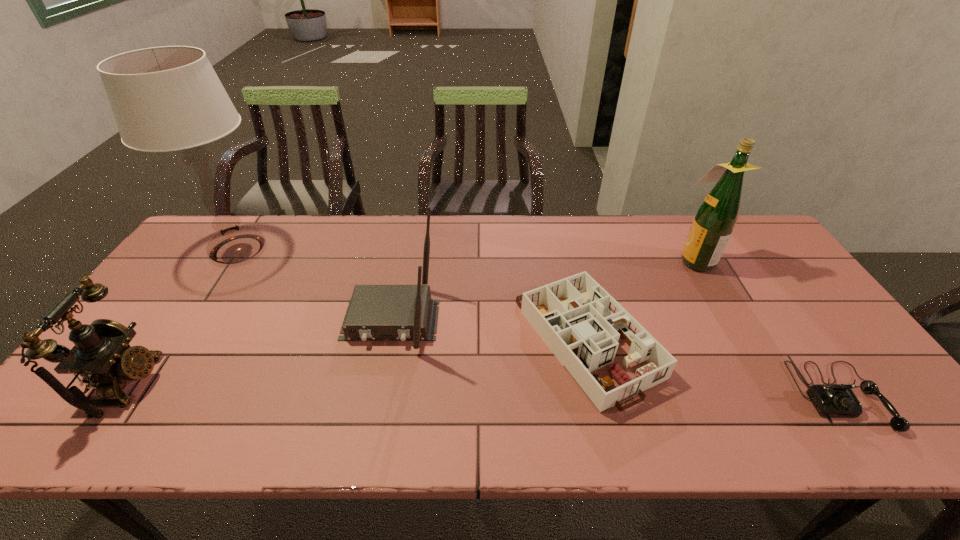
Find the location of a particular element. The width and height of the screenshot is (960, 540). free space located on the front-facing side of the fifth object from left to right is located at coordinates (603, 260).

The height and width of the screenshot is (540, 960). Identify the location of free space located on the front-facing side of the fifth object from left to right. (644, 260).

This screenshot has height=540, width=960. Find the location of `vacant space located on the back of the router to connect cables`. vacant space located on the back of the router to connect cables is located at coordinates (371, 421).

I want to click on vacant space positioned on the rotary dial of the left telephone, so click(x=324, y=383).

I want to click on free space located on the right of the fourth object from left to right, so click(x=799, y=339).

Image resolution: width=960 pixels, height=540 pixels. In order to click on table lamp present at the far edge in this screenshot , I will do `click(169, 98)`.

Where is `liquor present at the far edge`? The image size is (960, 540). liquor present at the far edge is located at coordinates (715, 219).

The image size is (960, 540). In order to click on dollhouse that is at the near edge in this screenshot , I will do `click(584, 338)`.

The image size is (960, 540). What are the coordinates of `table lamp positioned at the left edge` in the screenshot? It's located at (169, 98).

Image resolution: width=960 pixels, height=540 pixels. In order to click on telephone that is at the left edge in this screenshot , I will do `click(101, 354)`.